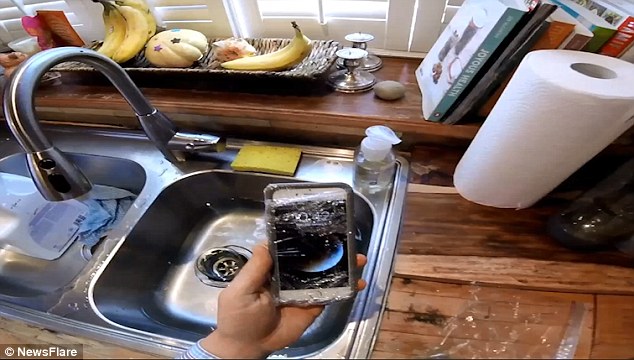
At what (x,y) coordinates should I click in order to perform the action: click on glass. Please return your answer as a coordinate pair (x, y). This screenshot has width=634, height=360. Looking at the image, I should click on (302, 229).